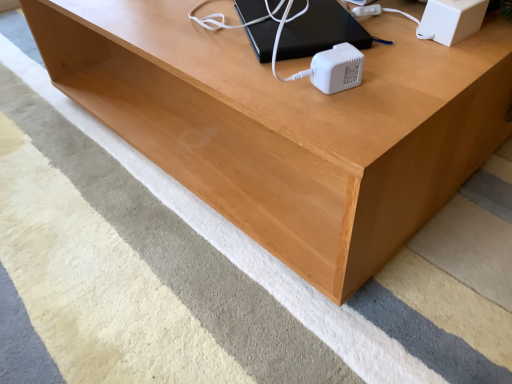
Identify the location of free region on the left part of black plastic computer at upper center. Image resolution: width=512 pixels, height=384 pixels. (190, 35).